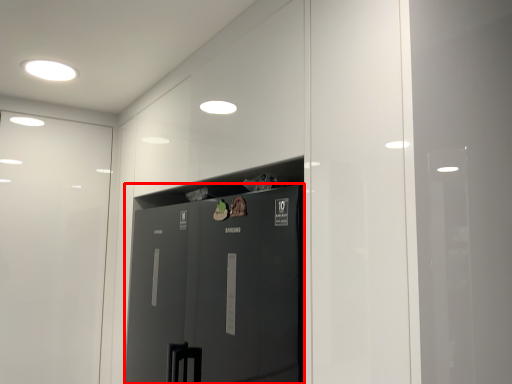
Question: In this image, where is door (annotated by the red box) located relative to lighting?

Choices:
 (A) left
 (B) right

Answer: (B)